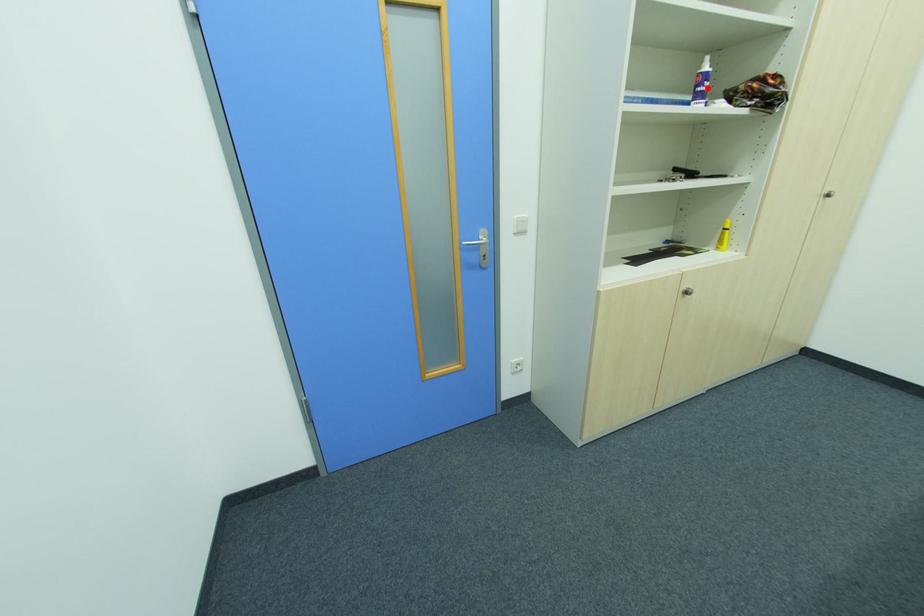
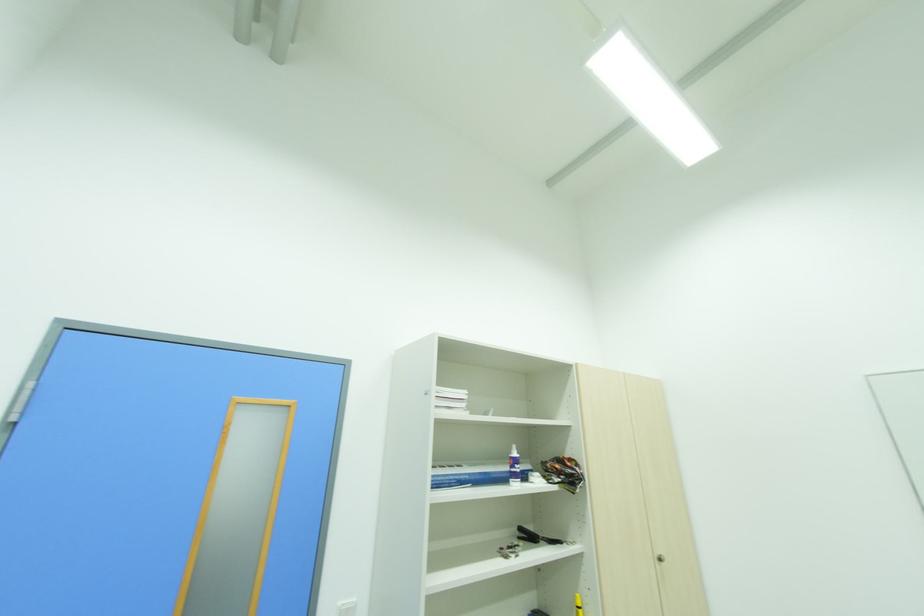
Where in the second image is the point corresponding to the highlighted location from the first image?

(520, 469)